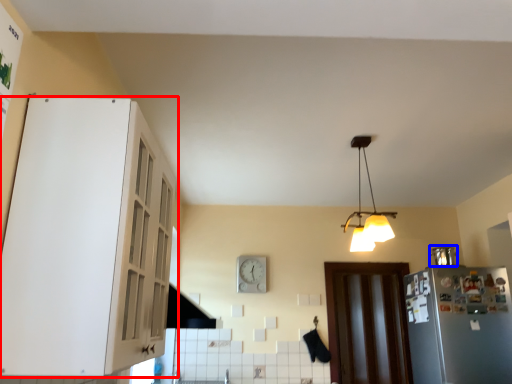
Question: Which object is further to the camera taking this photo, cabinetry (highlighted by a red box) or appliance (highlighted by a blue box)?

Choices:
 (A) cabinetry
 (B) appliance

Answer: (B)